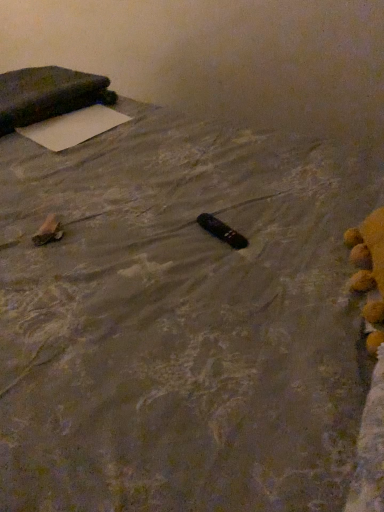
Measure the distance between point (201, 215) and camera.

The depth of point (201, 215) is 3.37 feet.

The image size is (384, 512). What do you see at coordinates (222, 231) in the screenshot?
I see `black plastic remote at center, marked as the 1th waste in a right-to-left arrangement` at bounding box center [222, 231].

In order to face white matte yoga mat at upper left, should I rotate leftwards or rightwards?

You should rotate left by 14.833 degrees.

I want to click on black plastic remote at center, which appears as the 2th waste when viewed from the left, so click(222, 231).

How many degrees apart are the facing directions of white matte yoga mat at upper left and dark fabric pillow at upper left?

1.18 degrees.

Could dark fabric pillow at upper left be considered to be inside white matte yoga mat at upper left?

No, dark fabric pillow at upper left is not a part of white matte yoga mat at upper left.

Which is farther from the camera, (20, 128) or (20, 92)?

The point (20, 92) is behind.

Is white matte yoga mat at upper left bigger than dark fabric pillow at upper left?

No.

Is dark fabric pillow at upper left surrounded by brown paper bag at lower left, the 1th waste in the left-to-right sequence?

Definitely not — dark fabric pillow at upper left is not inside brown paper bag at lower left, the 1th waste in the left-to-right sequence.

Consider the image. What's the angular difference between brown paper bag at lower left, the second waste when ordered from right to left, and dark fabric pillow at upper left's facing directions?

The angular difference between brown paper bag at lower left, the second waste when ordered from right to left, and dark fabric pillow at upper left is 15.3 degrees.

Considering the relative positions of brown paper bag at lower left, the 1th waste in the left-to-right sequence, and dark fabric pillow at upper left in the image provided, is brown paper bag at lower left, the 1th waste in the left-to-right sequence, to the left of dark fabric pillow at upper left from the viewer's perspective?

Incorrect, brown paper bag at lower left, the 1th waste in the left-to-right sequence, is not on the left side of dark fabric pillow at upper left.

Considering the relative sizes of brown paper bag at lower left, the second waste when ordered from right to left, and dark fabric pillow at upper left in the image provided, is brown paper bag at lower left, the second waste when ordered from right to left, wider than dark fabric pillow at upper left?

No, brown paper bag at lower left, the second waste when ordered from right to left, is not wider than dark fabric pillow at upper left.

You are a GUI agent. You are given a task and a screenshot of the screen. Output one action in this format:
    pyautogui.click(x=<x>, y=<y>)
    Task: Click on the 1st waste below the white matte yoga mat at upper left (from a real-world perspective)
    
    Given the screenshot: What is the action you would take?
    pyautogui.click(x=48, y=231)

From the image's perspective, is brown paper bag at lower left, the second waste when ordered from right to left, over white matte yoga mat at upper left?

No, from the image's perspective, brown paper bag at lower left, the second waste when ordered from right to left, is not above white matte yoga mat at upper left.

In the image, is brown paper bag at lower left, the 1th waste in the left-to-right sequence, positioned in front of or behind white matte yoga mat at upper left?

Visually, brown paper bag at lower left, the 1th waste in the left-to-right sequence, is located in front of white matte yoga mat at upper left.

Between point (59, 221) and point (48, 120), which one is positioned in front?

The point (59, 221) is closer.

Are black plastic remote at center, marked as the 1th waste in a right-to-left arrangement, and brown paper bag at lower left, the 1th waste in the left-to-right sequence, far apart?

No, there isn't a large distance between black plastic remote at center, marked as the 1th waste in a right-to-left arrangement, and brown paper bag at lower left, the 1th waste in the left-to-right sequence.

From a real-world perspective, does black plastic remote at center, which appears as the 2th waste when viewed from the left, stand above brown paper bag at lower left, the 1th waste in the left-to-right sequence?

Actually, black plastic remote at center, which appears as the 2th waste when viewed from the left, is physically below brown paper bag at lower left, the 1th waste in the left-to-right sequence, in the real world.

Considering the sizes of objects black plastic remote at center, marked as the 1th waste in a right-to-left arrangement, and brown paper bag at lower left, the second waste when ordered from right to left, in the image provided, who is taller, black plastic remote at center, marked as the 1th waste in a right-to-left arrangement, or brown paper bag at lower left, the second waste when ordered from right to left,?

black plastic remote at center, marked as the 1th waste in a right-to-left arrangement, is taller.

Would you say black plastic remote at center, which appears as the 2th waste when viewed from the left, is inside or outside brown paper bag at lower left, the 1th waste in the left-to-right sequence?

The correct answer is: outside.

From the image's perspective, is white matte yoga mat at upper left positioned above or below brown paper bag at lower left, the second waste when ordered from right to left?

white matte yoga mat at upper left is situated higher than brown paper bag at lower left, the second waste when ordered from right to left, in the image.

Which object is more forward, white matte yoga mat at upper left or brown paper bag at lower left, the second waste when ordered from right to left?

brown paper bag at lower left, the second waste when ordered from right to left.

Is brown paper bag at lower left, the 1th waste in the left-to-right sequence, inside white matte yoga mat at upper left?

No.

This screenshot has width=384, height=512. I want to click on yoga mat located behind the brown paper bag at lower left, the second waste when ordered from right to left, so click(73, 127).

Is dark fabric pillow at upper left to the left of white matte yoga mat at upper left from the viewer's perspective?

Yes, dark fabric pillow at upper left is to the left of white matte yoga mat at upper left.

Which is correct: dark fabric pillow at upper left is inside white matte yoga mat at upper left, or outside of it?

dark fabric pillow at upper left cannot be found inside white matte yoga mat at upper left.

Is dark fabric pillow at upper left next to white matte yoga mat at upper left?

No, dark fabric pillow at upper left is not touching white matte yoga mat at upper left.

How different are the orientations of dark fabric pillow at upper left and white matte yoga mat at upper left in degrees?

1.18 degrees.

Considering the sizes of objects dark fabric pillow at upper left and brown paper bag at lower left, the 1th waste in the left-to-right sequence, in the image provided, who is bigger, dark fabric pillow at upper left or brown paper bag at lower left, the 1th waste in the left-to-right sequence,?

dark fabric pillow at upper left.

From the picture: Are dark fabric pillow at upper left and brown paper bag at lower left, the second waste when ordered from right to left, far apart?

dark fabric pillow at upper left is near brown paper bag at lower left, the second waste when ordered from right to left, not far away.

Which of these two, dark fabric pillow at upper left or brown paper bag at lower left, the second waste when ordered from right to left, stands shorter?

brown paper bag at lower left, the second waste when ordered from right to left, is shorter.

How different are the orientations of dark fabric pillow at upper left and brown paper bag at lower left, the second waste when ordered from right to left, in degrees?

The angular difference between dark fabric pillow at upper left and brown paper bag at lower left, the second waste when ordered from right to left, is 15.3 degrees.

In the image, there is a dark fabric pillow at upper left. In order to click on yoga mat below it (from the image's perspective) in this screenshot , I will do `click(73, 127)`.

You are a GUI agent. You are given a task and a screenshot of the screen. Output one action in this format:
    pyautogui.click(x=<x>, y=<y>)
    Task: Click on the furniture that is above the brown paper bag at lower left, the 1th waste in the left-to-right sequence (from a real-world perspective)
    
    Given the screenshot: What is the action you would take?
    point(48,95)

When comparing their distances from white matte yoga mat at upper left, does black plastic remote at center, marked as the 1th waste in a right-to-left arrangement, or brown paper bag at lower left, the 1th waste in the left-to-right sequence, seem further?

black plastic remote at center, marked as the 1th waste in a right-to-left arrangement, is positioned further to the anchor white matte yoga mat at upper left.

Considering their positions, is white matte yoga mat at upper left positioned further to brown paper bag at lower left, the 1th waste in the left-to-right sequence, than dark fabric pillow at upper left?

The object further to brown paper bag at lower left, the 1th waste in the left-to-right sequence, is dark fabric pillow at upper left.

From the image, which object appears to be farther from black plastic remote at center, which appears as the 2th waste when viewed from the left, brown paper bag at lower left, the second waste when ordered from right to left, or white matte yoga mat at upper left?

Based on the image, white matte yoga mat at upper left appears to be further to black plastic remote at center, which appears as the 2th waste when viewed from the left.

Based on their spatial positions, is black plastic remote at center, which appears as the 2th waste when viewed from the left, or dark fabric pillow at upper left closer to brown paper bag at lower left, the second waste when ordered from right to left?

→ The object closer to brown paper bag at lower left, the second waste when ordered from right to left, is black plastic remote at center, which appears as the 2th waste when viewed from the left.

When comparing their distances from white matte yoga mat at upper left, does brown paper bag at lower left, the 1th waste in the left-to-right sequence, or dark fabric pillow at upper left seem closer?

dark fabric pillow at upper left lies closer to white matte yoga mat at upper left than the other object.

From the image, which object appears to be farther from black plastic remote at center, which appears as the 2th waste when viewed from the left, white matte yoga mat at upper left or dark fabric pillow at upper left?

dark fabric pillow at upper left is positioned further to the anchor black plastic remote at center, which appears as the 2th waste when viewed from the left.

Which object lies nearer to the anchor point white matte yoga mat at upper left, brown paper bag at lower left, the second waste when ordered from right to left, or black plastic remote at center, marked as the 1th waste in a right-to-left arrangement?

brown paper bag at lower left, the second waste when ordered from right to left, is positioned closer to the anchor white matte yoga mat at upper left.

Looking at the image, which one is located closer to white matte yoga mat at upper left, dark fabric pillow at upper left or brown paper bag at lower left, the 1th waste in the left-to-right sequence?

Among the two, dark fabric pillow at upper left is located nearer to white matte yoga mat at upper left.

Where is `yoga mat between dark fabric pillow at upper left and brown paper bag at lower left, the 1th waste in the left-to-right sequence, in the up-down direction`? yoga mat between dark fabric pillow at upper left and brown paper bag at lower left, the 1th waste in the left-to-right sequence, in the up-down direction is located at coordinates (73, 127).

The width and height of the screenshot is (384, 512). Find the location of `waste located between dark fabric pillow at upper left and black plastic remote at center, marked as the 1th waste in a right-to-left arrangement, in the left-right direction`. waste located between dark fabric pillow at upper left and black plastic remote at center, marked as the 1th waste in a right-to-left arrangement, in the left-right direction is located at coordinates (48, 231).

I want to click on waste between white matte yoga mat at upper left and black plastic remote at center, marked as the 1th waste in a right-to-left arrangement, from left to right, so click(48, 231).

At what (x,y) coordinates should I click in order to perform the action: click on yoga mat located between dark fabric pillow at upper left and black plastic remote at center, which appears as the 2th waste when viewed from the left, in the left-right direction. Please return your answer as a coordinate pair (x, y). Looking at the image, I should click on (73, 127).